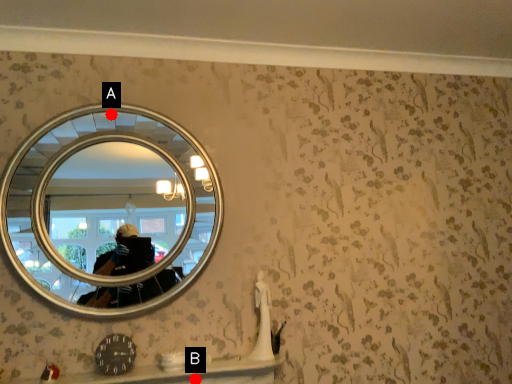
Question: Two points are circled on the image, labeled by A and B beside each circle. Which point appears farthest from the camera in this image?

Choices:
 (A) A is further
 (B) B is further

Answer: (A)